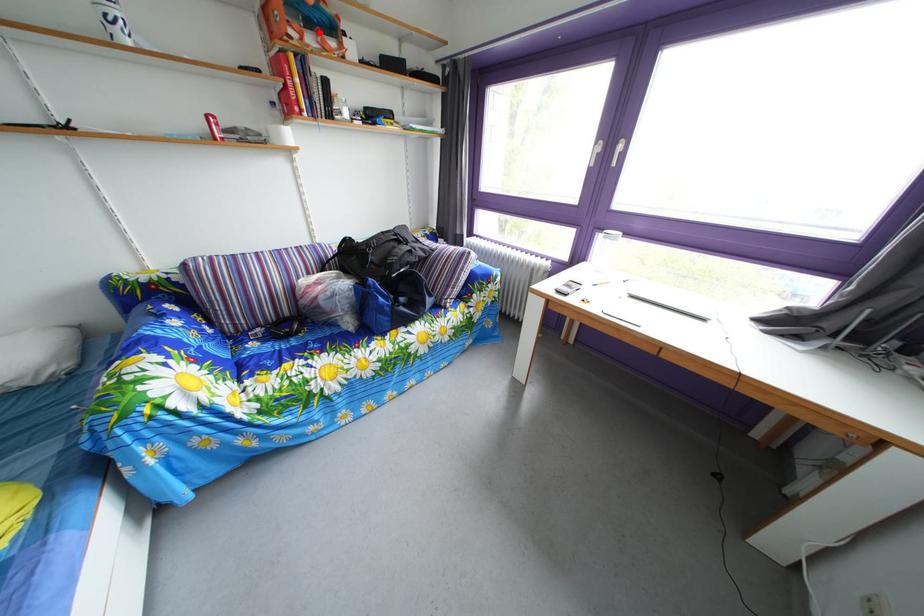
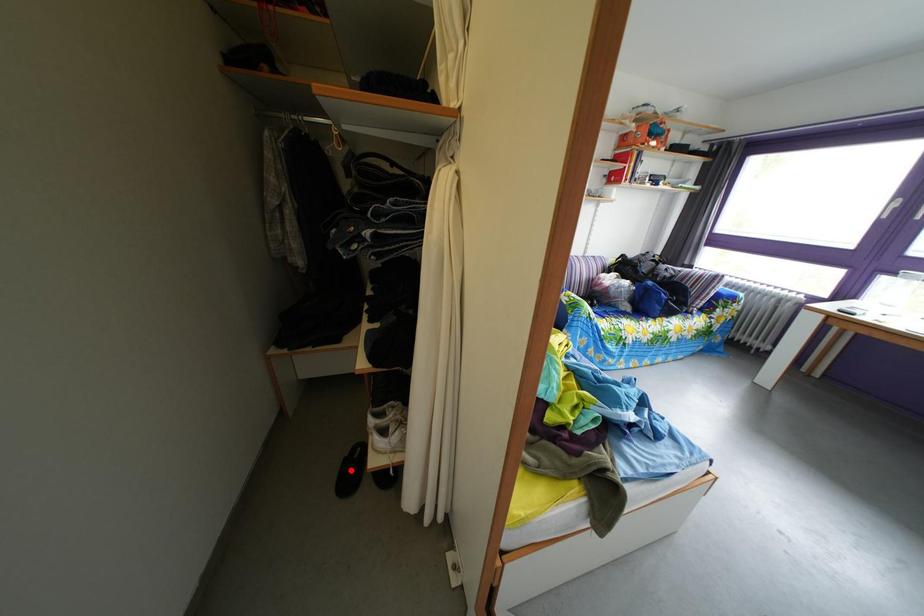
I am providing you with two images of the same scene from different viewpoints. A red point is marked on the first image and another point is marked on the second image. Are the points marked in image1 and image2 representing the same 3D position?

No